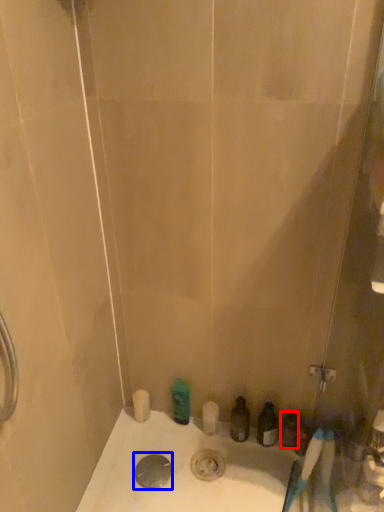
Question: Among these objects, which one is farthest to the camera, toiletry (highlighted by a red box) or drain (highlighted by a blue box)?

Choices:
 (A) toiletry
 (B) drain

Answer: (A)